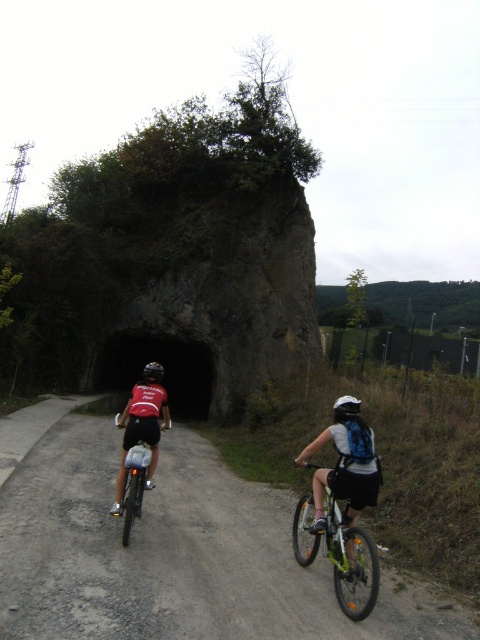
Question: Can you confirm if black stone tunnel at center is bigger than black matte bicycle helmet at center?

Choices:
 (A) no
 (B) yes

Answer: (A)

Question: Is dirt/gravel road at center closer to the viewer compared to black stone tunnel at center?

Choices:
 (A) yes
 (B) no

Answer: (A)

Question: Which point is farther to the camera?

Choices:
 (A) (183, 355)
 (B) (75, 630)
 (C) (158, 369)

Answer: (A)

Question: Considering the real-world distances, which object is farthest from the dirt/gravel road at center?

Choices:
 (A) green matte bicycle at right
 (B) shiny silver bicycle at center

Answer: (B)

Question: Is white matte bicycle helmet at center above black matte bicycle helmet at center?

Choices:
 (A) yes
 (B) no

Answer: (B)

Question: Which object is the closest to the green matte bicycle at right?

Choices:
 (A) black stone tunnel at center
 (B) white matte bicycle helmet at center
 (C) shiny silver bicycle at center
 (D) black matte bicycle helmet at center

Answer: (B)